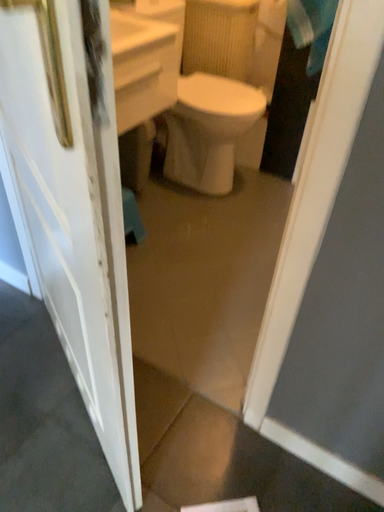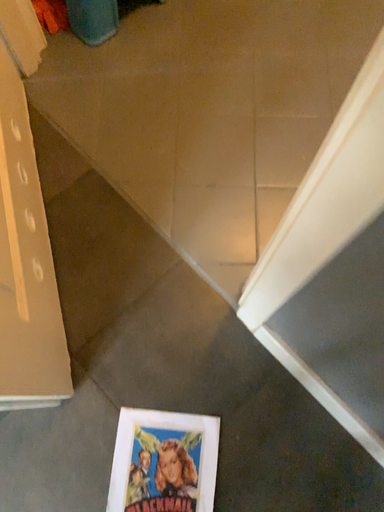
Question: Which way did the camera rotate in the video?

Choices:
 (A) rotated downward
 (B) rotated upward

Answer: (A)